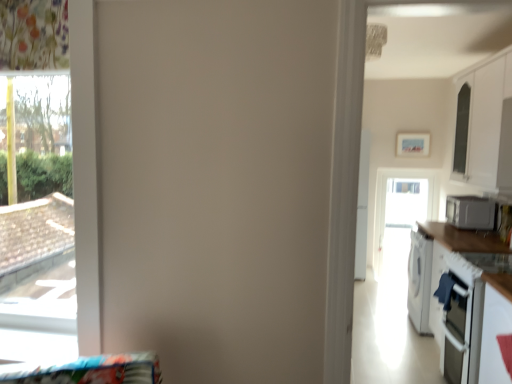
Question: From their relative heights in the image, would you say white glossy countertop at right is taller or shorter than transparent glass window at left?

Choices:
 (A) short
 (B) tall

Answer: (A)

Question: Is point (430, 301) closer or farther from the camera than point (47, 317)?

Choices:
 (A) closer
 (B) farther

Answer: (B)

Question: Estimate the real-world distances between objects in this image. Which object is closer to the transparent glass window at left?

Choices:
 (A) white glossy countertop at right
 (B) transparent glass screen door at center
 (C) satin silver microwave at right
 (D) white glossy cabinet at upper right

Answer: (A)

Question: Which object is positioned farthest from the transparent glass screen door at center?

Choices:
 (A) white glossy cabinet at upper right
 (B) white glossy countertop at right
 (C) satin silver microwave at right
 (D) transparent glass window at left

Answer: (D)